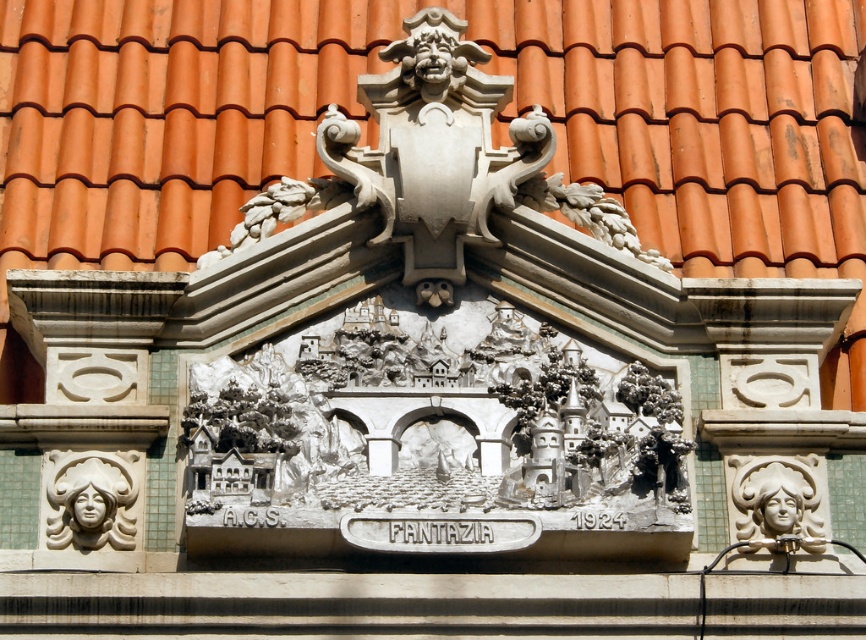
Is point (95, 497) farther from camera compared to point (818, 532)?

No, (95, 497) is closer to viewer.

How distant is white stone face at center from white glossy sculpture at right?

white stone face at center is 15.21 meters from white glossy sculpture at right.

Image resolution: width=866 pixels, height=640 pixels. I want to click on white stone face at center, so click(89, 499).

Which is more to the left, orange clay tiles at center or white glossy sculpture at right?

orange clay tiles at center

Find the location of `orange clay tiles at center`. orange clay tiles at center is located at coordinates (494, 129).

Is the position of orange clay tiles at center less distant than that of white stone face at center?

No, it is not.

Which is in front, point (758, 8) or point (87, 465)?

Point (87, 465) is more forward.

Find the location of `orange clay tiles at center`. orange clay tiles at center is located at coordinates (494, 129).